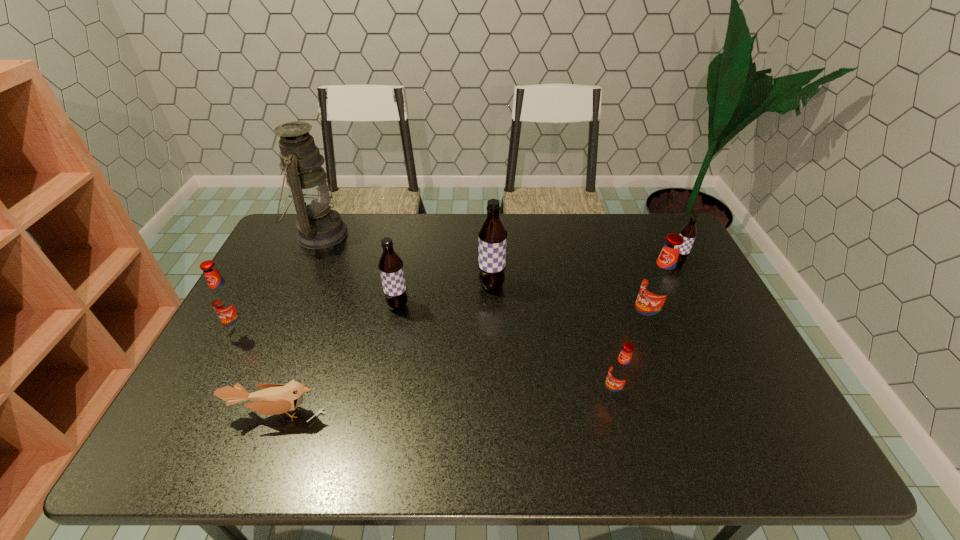
In order to click on the sixth object from left to right in this screenshot , I will do `click(620, 371)`.

The width and height of the screenshot is (960, 540). In order to click on the farthest root beer in this screenshot , I will do `click(688, 232)`.

Where is `the rightmost brown root beer`? Image resolution: width=960 pixels, height=540 pixels. the rightmost brown root beer is located at coordinates (688, 232).

Where is `the shortest object`? the shortest object is located at coordinates (274, 399).

You are a GUI agent. You are given a task and a screenshot of the screen. Output one action in this format:
    pyautogui.click(x=<x>, y=<y>)
    Task: Click on the free space located 0.260m on the front of the tallest object
    The width and height of the screenshot is (960, 540).
    Given the screenshot: What is the action you would take?
    pyautogui.click(x=283, y=316)

Identify the location of blank space located on the left of the second farthest root beer. The image size is (960, 540). (357, 286).

Find the location of a particular element. vacant area located 0.200m on the right of the biggest red root beer is located at coordinates (731, 322).

The image size is (960, 540). I want to click on free space located 0.280m on the right of the second smallest brown root beer, so click(505, 306).

The height and width of the screenshot is (540, 960). What are the coordinates of `vacant area situated 0.400m on the right of the leftmost root beer` in the screenshot? It's located at (397, 329).

What are the coordinates of `vacant space located 0.090m on the front of the smallest red root beer` in the screenshot? It's located at (624, 438).